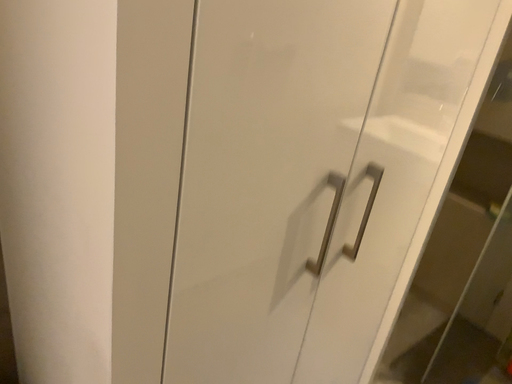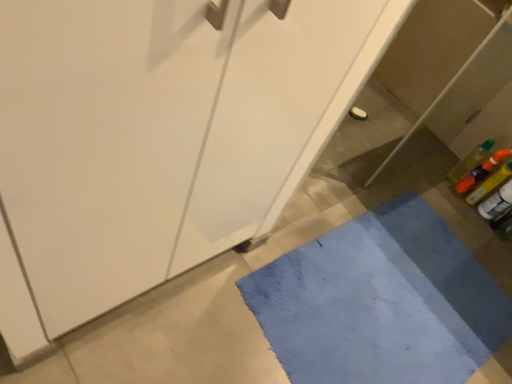
Question: Which way did the camera rotate in the video?

Choices:
 (A) rotated upward
 (B) rotated downward

Answer: (B)